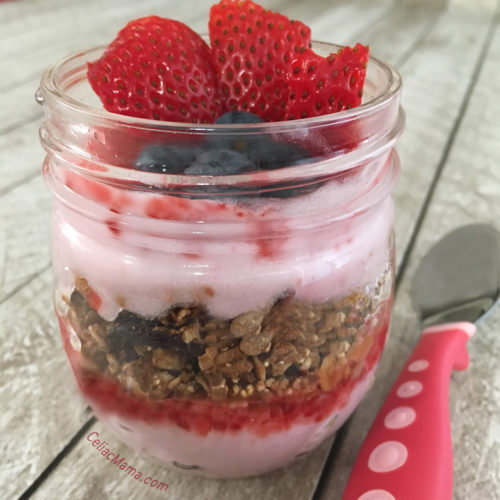
The image size is (500, 500). Identify the location of jar. (252, 302).